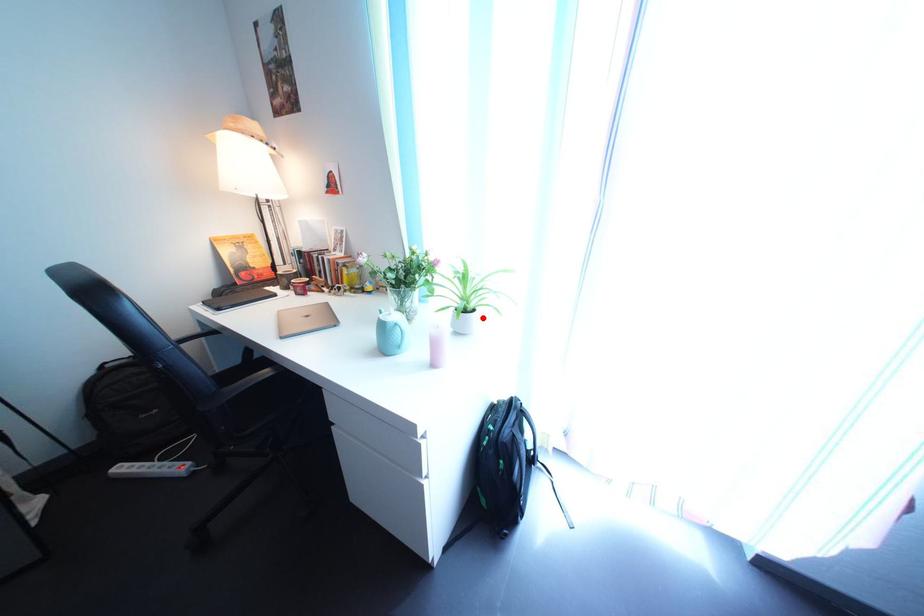
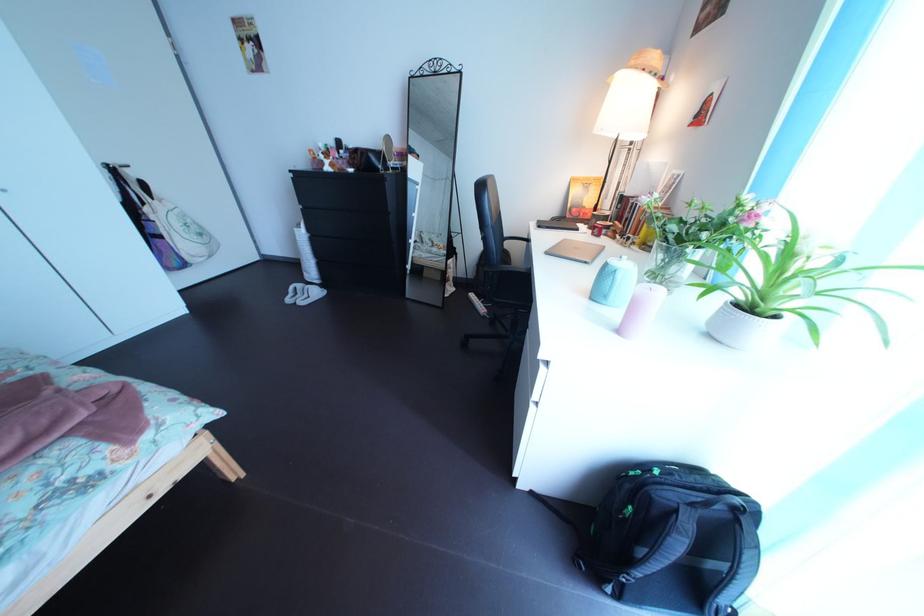
In the second image, find the point that corresponds to the highlighted location in the first image.

(773, 318)